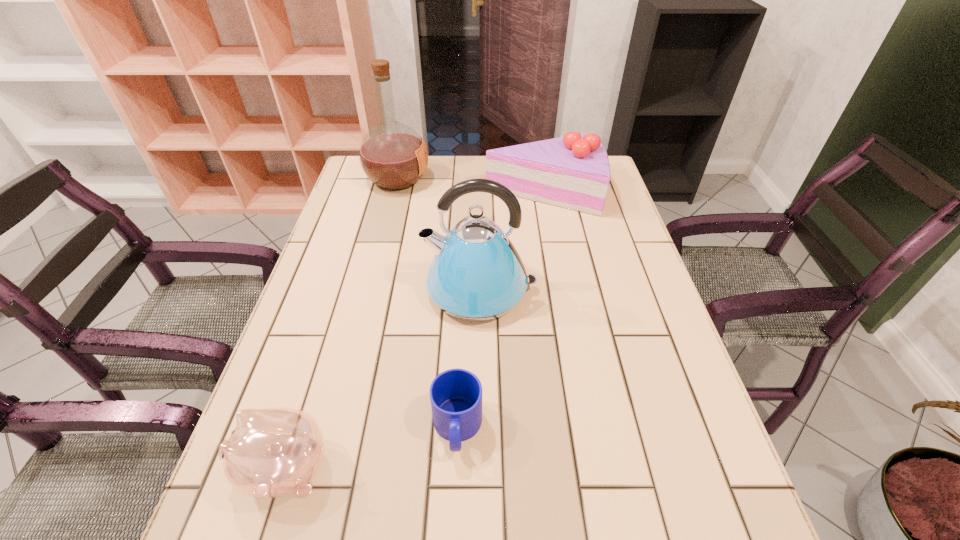
This screenshot has width=960, height=540. What are the coordinates of `free space between the mug and the tallest object` in the screenshot? It's located at (427, 303).

Point out which object is positioned as the nearest to the cake. Please provide its 2D coordinates. Your answer should be formatted as a tuple, i.e. [(x, y)], where the tuple contains the x and y coordinates of a point satisfying the conditions above.

[(476, 274)]

Locate an element on the screen. The height and width of the screenshot is (540, 960). object that is the third closest to the third nearest object is located at coordinates (393, 156).

Identify the location of vacant space that satisfies the following two spatial constraints: 1. on the front side of the third tallest object; 2. at the spout of the kettle. Image resolution: width=960 pixels, height=540 pixels. (561, 289).

Locate an element on the screen. The height and width of the screenshot is (540, 960). blank area in the image that satisfies the following two spatial constraints: 1. on the back side of the third tallest object; 2. on the front label of the tallest object is located at coordinates (540, 179).

Find the location of `free spot that satisfies the following two spatial constraints: 1. at the spout of the kettle; 2. on the side with the handle of the shortest object`. free spot that satisfies the following two spatial constraints: 1. at the spout of the kettle; 2. on the side with the handle of the shortest object is located at coordinates (480, 428).

At what (x,y) coordinates should I click in order to perform the action: click on free space that satisfies the following two spatial constraints: 1. at the spout of the third nearest object; 2. on the side with the handle of the shortest object. Please return your answer as a coordinate pair (x, y). The height and width of the screenshot is (540, 960). Looking at the image, I should click on (480, 428).

Where is `vacant space that satisfies the following two spatial constraints: 1. on the front side of the cake; 2. at the spout of the third farthest object`? The image size is (960, 540). vacant space that satisfies the following two spatial constraints: 1. on the front side of the cake; 2. at the spout of the third farthest object is located at coordinates (561, 289).